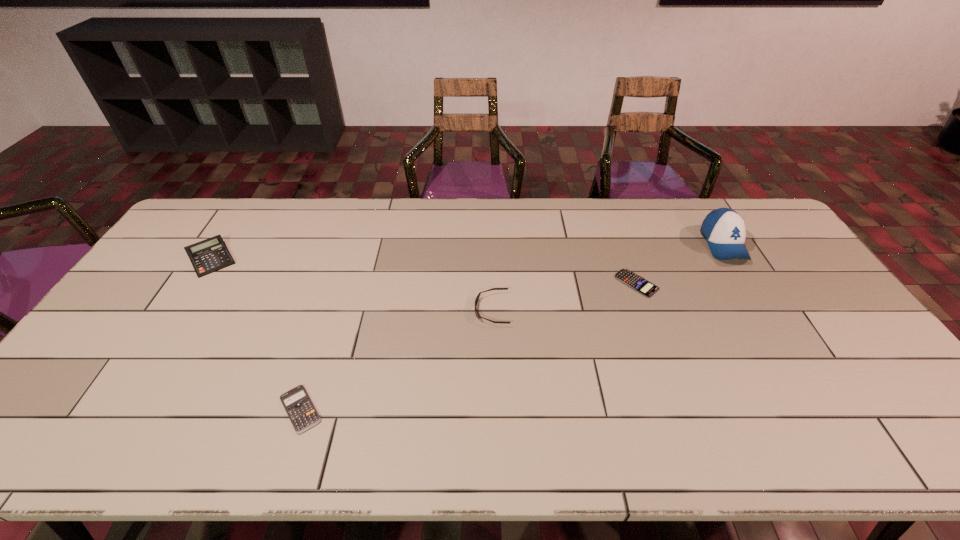
Image resolution: width=960 pixels, height=540 pixels. Find the location of `the tallest object`. the tallest object is located at coordinates (724, 229).

The width and height of the screenshot is (960, 540). I want to click on the rightmost object, so 724,229.

Locate an element on the screen. the leftmost object is located at coordinates (210, 255).

You are a GUI agent. You are given a task and a screenshot of the screen. Output one action in this format:
    pyautogui.click(x=<x>, y=<y>)
    Task: Click on the tallest calculator
    This screenshot has height=540, width=960.
    Given the screenshot: What is the action you would take?
    pyautogui.click(x=210, y=255)

I want to click on the third shortest object, so click(x=478, y=316).

Find the location of a particular element. sunglasses is located at coordinates (478, 316).

Identify the location of the rightmost calculator. (634, 281).

You are a GUI agent. You are given a task and a screenshot of the screen. Output one action in this format:
    pyautogui.click(x=<x>, y=<y>)
    Task: Click on the nearest calculator
    
    Given the screenshot: What is the action you would take?
    pyautogui.click(x=303, y=415)

The width and height of the screenshot is (960, 540). In order to click on the fourth object from right to left in this screenshot , I will do `click(303, 415)`.

This screenshot has height=540, width=960. I want to click on free space located on the front-facing side of the tallest object, so click(x=778, y=333).